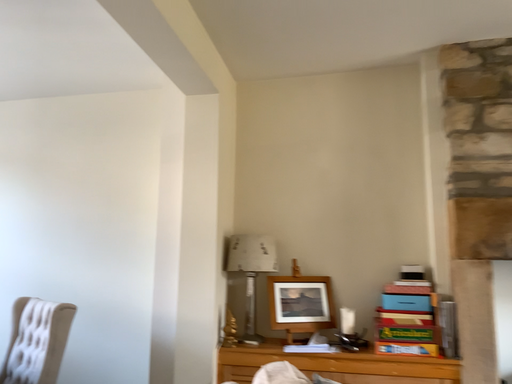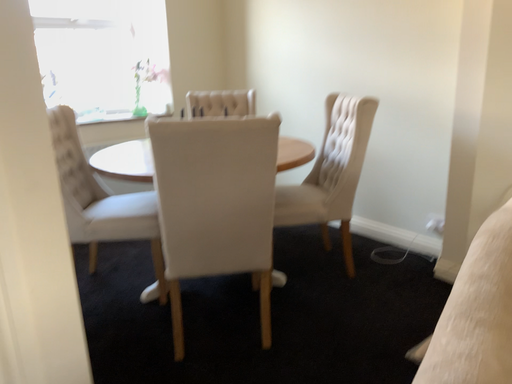
Question: Which way did the camera rotate in the video?

Choices:
 (A) rotated left
 (B) rotated right

Answer: (A)